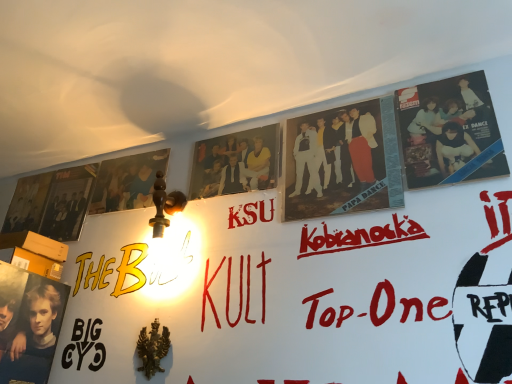
Question: From the image's perspective, is matte black poster at lower left, the fourth person from the right, positioned above or below matte yellow shirt at center, marked as the second person in a left-to-right arrangement?

Choices:
 (A) above
 (B) below

Answer: (B)

Question: Does point (40, 349) appear closer or farther from the camera than point (205, 145)?

Choices:
 (A) farther
 (B) closer

Answer: (B)

Question: Which of these objects is positioned closest to the matte white pants at center, the 3th person when ordered from left to right?

Choices:
 (A) matte black album at upper right, the 4th person positioned from the left
 (B) matte black poster at upper left, which ranks as the 2th poster in left-to-right order
 (C) matte yellow shirt at center, marked as the second person in a left-to-right arrangement
 (D) matte black movie poster at upper left
 (E) matte black poster at lower left, which ranks as the first person in left-to-right order

Answer: (A)

Question: Which object is positioned closest to the matte black album cover at left, which is the second poster from right to left?

Choices:
 (A) matte black poster at upper left, marked as the first poster in a right-to-left arrangement
 (B) matte black poster at lower left, which ranks as the first person in left-to-right order
 (C) matte yellow shirt at center, marked as the second person in a left-to-right arrangement
 (D) matte white pants at center, the 3th person when ordered from left to right
 (E) matte black album at upper right, the 1th person when ordered from right to left

Answer: (A)